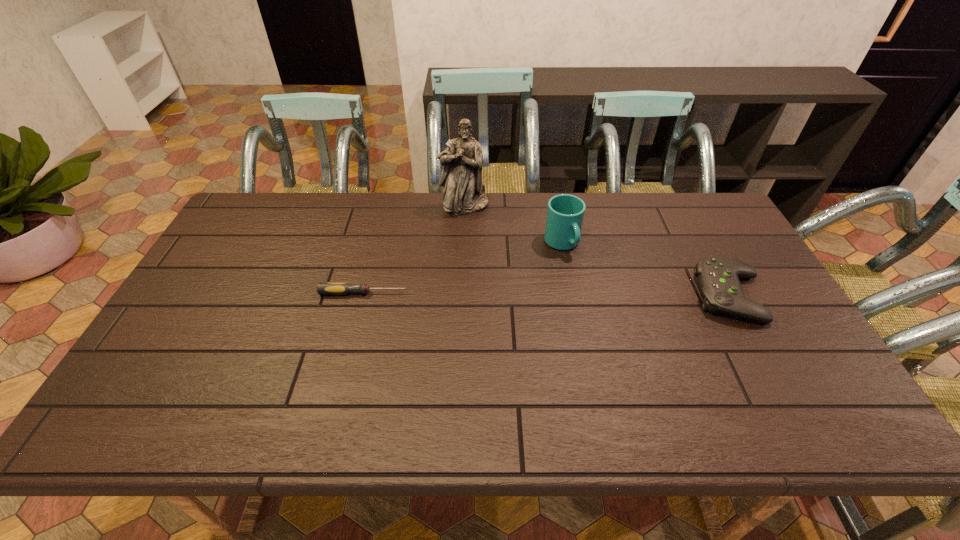
I want to click on free space between the tallest object and the rightmost object, so click(x=597, y=251).

The height and width of the screenshot is (540, 960). What are the coordinates of `free space between the control and the second tallest object` in the screenshot? It's located at (646, 269).

Locate an element on the screen. The width and height of the screenshot is (960, 540). free space between the farthest object and the leftmost object is located at coordinates (415, 249).

You are a GUI agent. You are given a task and a screenshot of the screen. Output one action in this format:
    pyautogui.click(x=<x>, y=<y>)
    Task: Click on the unoccupied position between the shortest object and the second object from left to right
    The height and width of the screenshot is (540, 960).
    Given the screenshot: What is the action you would take?
    pyautogui.click(x=415, y=249)

At what (x,y) coordinates should I click in order to perform the action: click on vacant area that lies between the figurine and the shortest object. Please return your answer as a coordinate pair (x, y). This screenshot has width=960, height=540. Looking at the image, I should click on (415, 249).

Identify the location of unoccupied position between the tallest object and the rightmost object. (597, 251).

Locate which object is the closest to the leftmost object. Please provide its 2D coordinates. Your answer should be formatted as a tuple, i.e. [(x, y)], where the tuple contains the x and y coordinates of a point satisfying the conditions above.

[(461, 175)]

What are the coordinates of `object that is the nearest to the rightmost object` in the screenshot? It's located at (565, 213).

The width and height of the screenshot is (960, 540). What are the coordinates of `blank area in the image that satisfies the following two spatial constraints: 1. on the front side of the cup; 2. on the right side of the farthest object` in the screenshot? It's located at (463, 244).